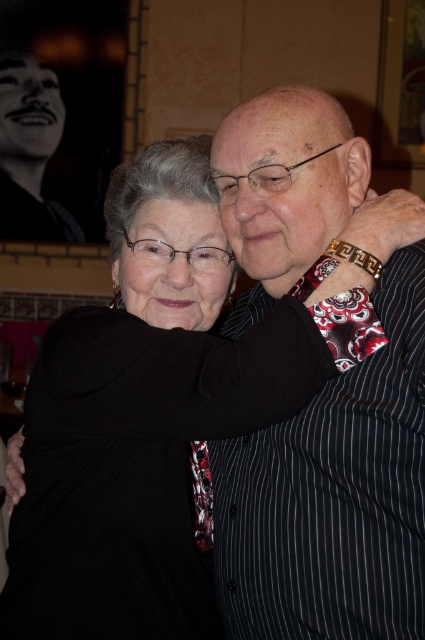
Question: Does black striped shirt at center have a smaller size compared to black fabric at center?

Choices:
 (A) yes
 (B) no

Answer: (B)

Question: Which point is closer to the camera?

Choices:
 (A) (311, 588)
 (B) (181, 280)

Answer: (A)

Question: Among these objects, which one is nearest to the camera?

Choices:
 (A) black fabric at center
 (B) black striped shirt at center

Answer: (B)

Question: Does black striped shirt at center appear over black fabric at center?

Choices:
 (A) no
 (B) yes

Answer: (A)

Question: Is black striped shirt at center bigger than black fabric at center?

Choices:
 (A) yes
 (B) no

Answer: (A)